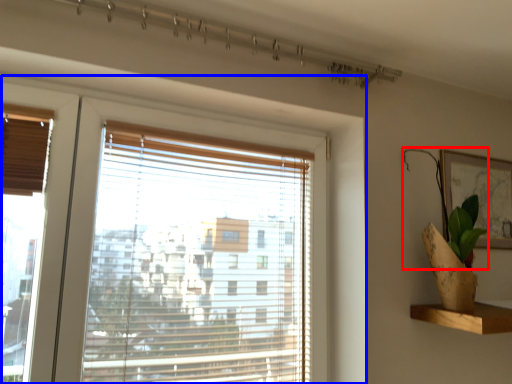
Question: Which object is further to the camera taking this photo, plant (highlighted by a red box) or window (highlighted by a blue box)?

Choices:
 (A) plant
 (B) window

Answer: (A)